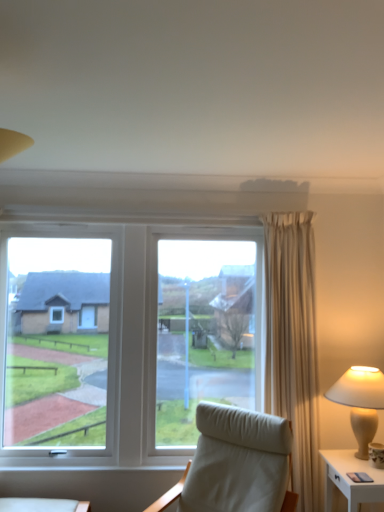
Question: Does white ceramic lamp at right appear on the right side of white glossy nightstand at lower right?

Choices:
 (A) no
 (B) yes

Answer: (B)

Question: From the image's perspective, does white ceramic lamp at right appear higher than white glossy nightstand at lower right?

Choices:
 (A) yes
 (B) no

Answer: (A)

Question: Would you consider white ceramic lamp at right to be distant from white glossy nightstand at lower right?

Choices:
 (A) yes
 (B) no

Answer: (B)

Question: Could white glossy nightstand at lower right be considered to be inside white ceramic lamp at right?

Choices:
 (A) yes
 (B) no

Answer: (B)

Question: Considering the relative sizes of white ceramic lamp at right and white glossy nightstand at lower right in the image provided, is white ceramic lamp at right smaller than white glossy nightstand at lower right?

Choices:
 (A) yes
 (B) no

Answer: (B)

Question: Is white glossy nightstand at lower right inside the boundaries of white fabric chair at center, or outside?

Choices:
 (A) outside
 (B) inside

Answer: (A)

Question: In terms of height, does white glossy nightstand at lower right look taller or shorter compared to white fabric chair at center?

Choices:
 (A) short
 (B) tall

Answer: (A)

Question: Considering the positions of point (372, 484) and point (258, 418), is point (372, 484) closer or farther from the camera than point (258, 418)?

Choices:
 (A) farther
 (B) closer

Answer: (B)

Question: From the image's perspective, is white glossy nightstand at lower right positioned above or below white fabric chair at center?

Choices:
 (A) below
 (B) above

Answer: (A)

Question: Considering the positions of white fabric chair at center and white glossy nightstand at lower right in the image, is white fabric chair at center wider or thinner than white glossy nightstand at lower right?

Choices:
 (A) thin
 (B) wide

Answer: (B)

Question: Considering the positions of white fabric chair at center and white glossy nightstand at lower right in the image, is white fabric chair at center bigger or smaller than white glossy nightstand at lower right?

Choices:
 (A) big
 (B) small

Answer: (A)

Question: Relative to white glossy nightstand at lower right, is white fabric chair at center in front or behind?

Choices:
 (A) behind
 (B) front

Answer: (B)

Question: Based on their positions, is white fabric chair at center located to the left or right of white glossy nightstand at lower right?

Choices:
 (A) right
 (B) left

Answer: (B)

Question: From a real-world perspective, is white ceramic lamp at right physically located above or below white fabric chair at center?

Choices:
 (A) below
 (B) above

Answer: (B)

Question: Is white ceramic lamp at right wider or thinner than white fabric chair at center?

Choices:
 (A) thin
 (B) wide

Answer: (A)